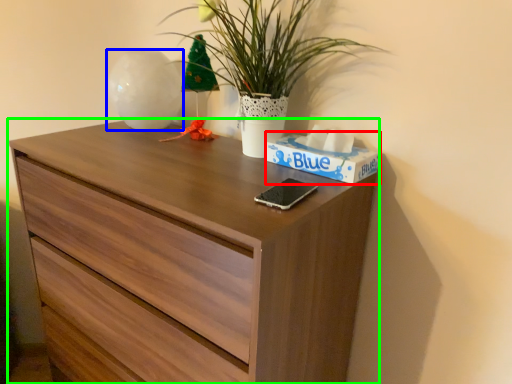
Question: Considering the real-world distances, which object is closest to box (highlighted by a red box)? vase (highlighted by a blue box) or chest of drawers (highlighted by a green box).

Choices:
 (A) vase
 (B) chest of drawers

Answer: (B)